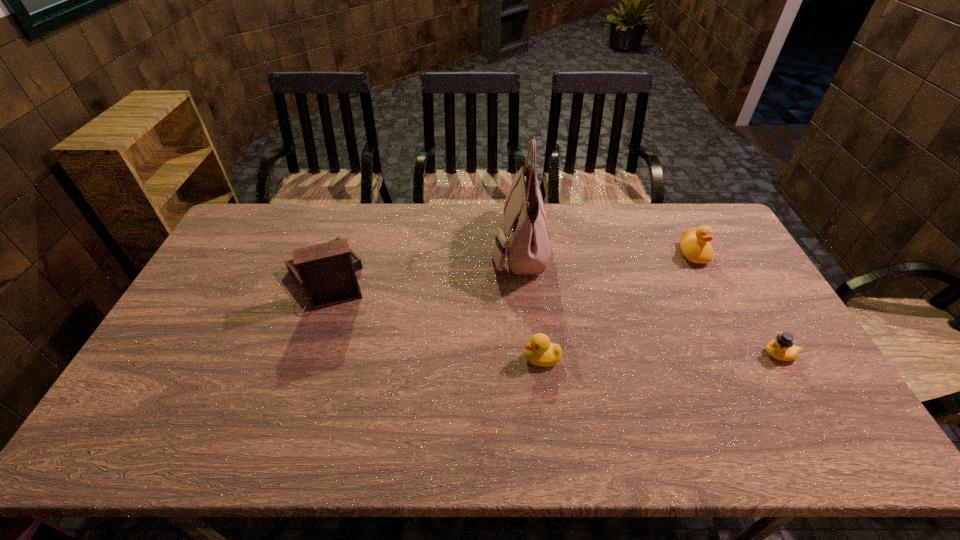
This screenshot has width=960, height=540. Identify the location of the tallest object. (526, 242).

You are a GUI agent. You are given a task and a screenshot of the screen. Output one action in this format:
    pyautogui.click(x=<x>, y=<y>)
    Task: Click on the leftmost object
    The height and width of the screenshot is (540, 960).
    Given the screenshot: What is the action you would take?
    pyautogui.click(x=326, y=272)

Identify the location of the second tallest object. tap(326, 272).

Locate an element on the screen. The image size is (960, 540). the third tallest object is located at coordinates (694, 243).

The height and width of the screenshot is (540, 960). In order to click on the second duck from left to right in this screenshot , I will do `click(694, 243)`.

Identify the location of the fourth tallest object. Image resolution: width=960 pixels, height=540 pixels. (540, 352).

This screenshot has width=960, height=540. What are the coordinates of `the second shortest duck` in the screenshot? It's located at (540, 352).

You are a GUI agent. You are given a task and a screenshot of the screen. Output one action in this format:
    pyautogui.click(x=<x>, y=<y>)
    Task: Click on the rightmost duck
    This screenshot has width=960, height=540.
    Given the screenshot: What is the action you would take?
    pyautogui.click(x=782, y=348)

Locate an element on the screen. This screenshot has width=960, height=540. the shortest object is located at coordinates (782, 348).

I want to click on vacant area situated on the side of the handbag with the attached pouch, so click(x=390, y=246).